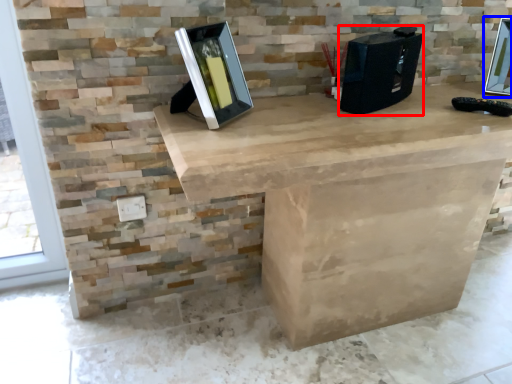
Question: Which object appears closest to the camera in this image, desktop computer (highlighted by a red box) or picture frame (highlighted by a blue box)?

Choices:
 (A) desktop computer
 (B) picture frame

Answer: (A)